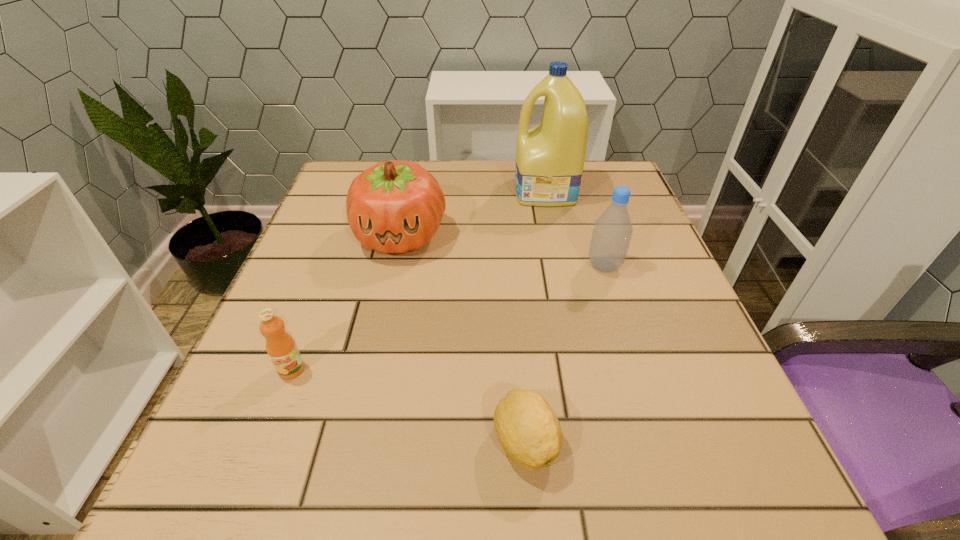
Select which object appears as the fourth closest to the bottle. Please provide its 2D coordinates. Your answer should be formatted as a tuple, i.e. [(x, y)], where the tuple contains the x and y coordinates of a point satisfying the conditions above.

[(283, 352)]

I want to click on vacant space that satisfies the following two spatial constraints: 1. on the label of the farthest object; 2. at the stem end of the nearest object, so click(x=597, y=442).

Find the location of `blank area in the image that satisfies the following two spatial constraints: 1. on the label of the detergent; 2. at the stem end of the shortest object`. blank area in the image that satisfies the following two spatial constraints: 1. on the label of the detergent; 2. at the stem end of the shortest object is located at coordinates (597, 442).

Where is `vacant space that satisfies the following two spatial constraints: 1. on the label of the tallest object; 2. on the front label of the orange juice`? The image size is (960, 540). vacant space that satisfies the following two spatial constraints: 1. on the label of the tallest object; 2. on the front label of the orange juice is located at coordinates (582, 369).

You are a GUI agent. You are given a task and a screenshot of the screen. Output one action in this format:
    pyautogui.click(x=<x>, y=<y>)
    Task: Click on the free space that satisfies the following two spatial constraints: 1. on the label of the tallest object; 2. at the stem end of the shortest object
    
    Given the screenshot: What is the action you would take?
    pyautogui.click(x=597, y=442)

Locate an element on the screen. This screenshot has width=960, height=540. free region that satisfies the following two spatial constraints: 1. on the side of the pumpkin with the cute face; 2. on the right side of the bottle is located at coordinates (394, 266).